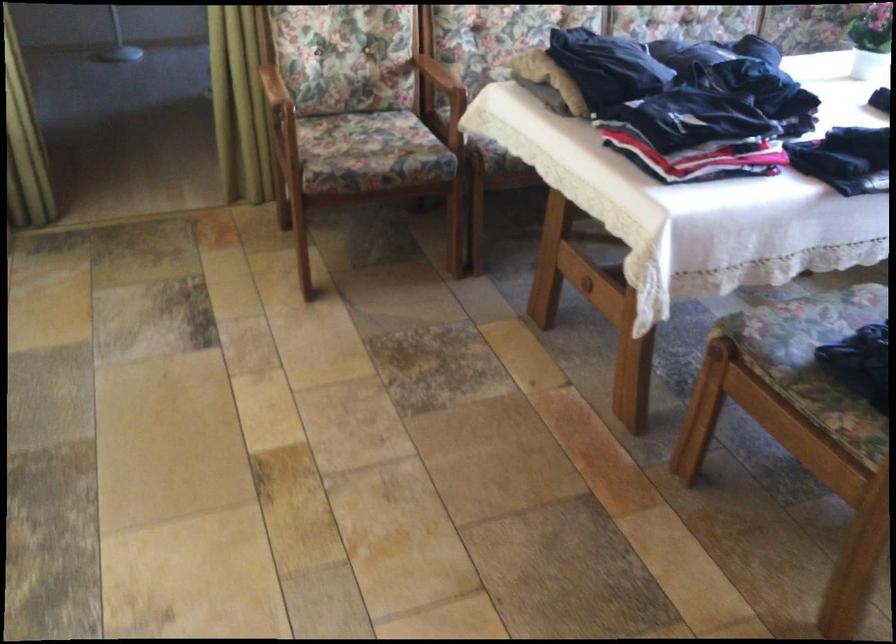
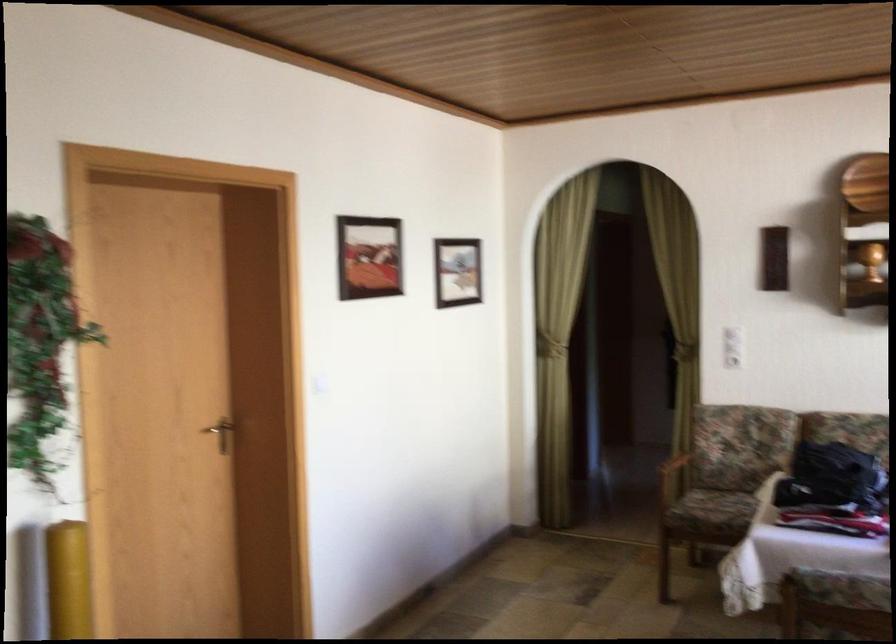
Locate, in the second image, the point that corresponds to (674,95) in the first image.

(831, 478)